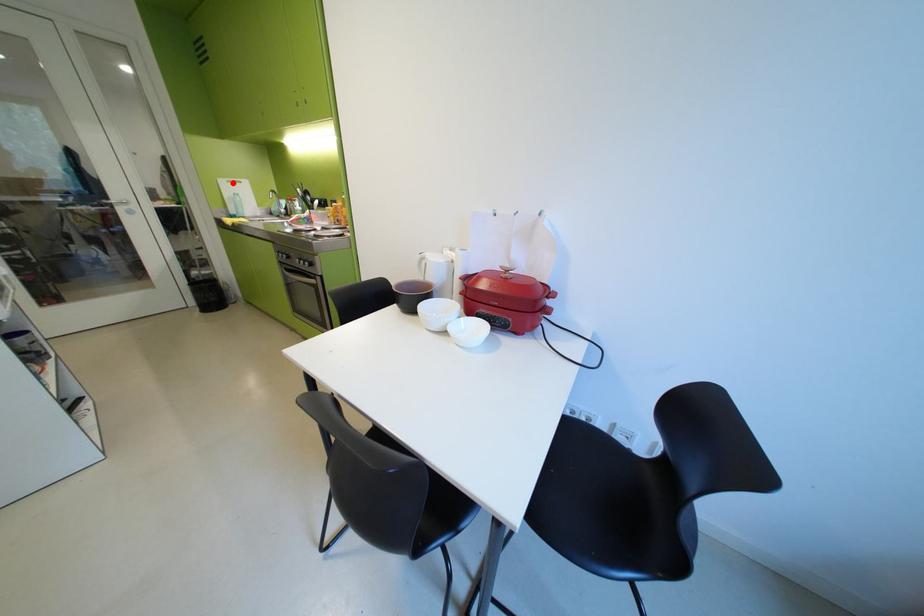
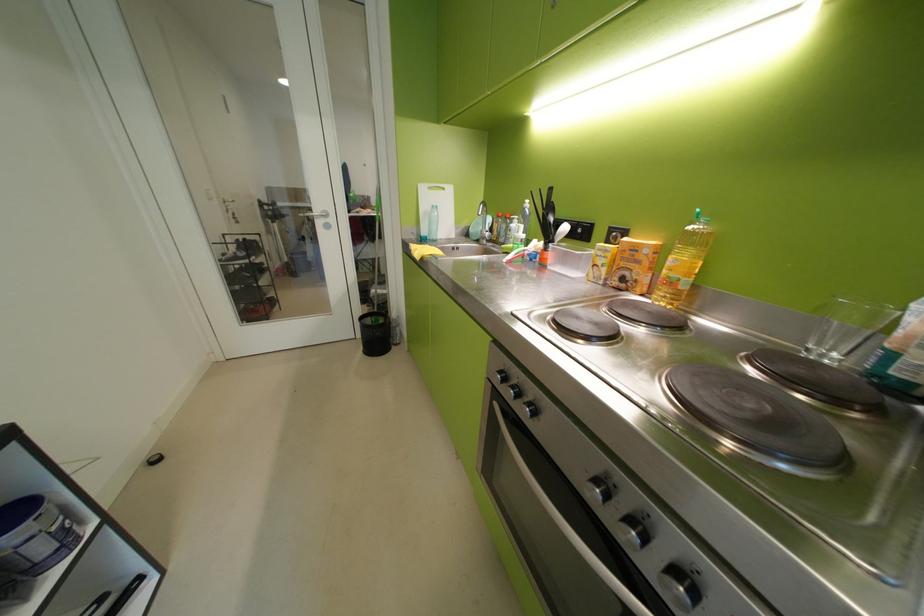
Question: A red point is marked in image1. In image2, is the corresponding 3D point closer to the camera or farther? Reply with the corresponding letter.

Choices:
 (A) The corresponding 3D point is closer.
 (B) The corresponding 3D point is farther.

Answer: (A)